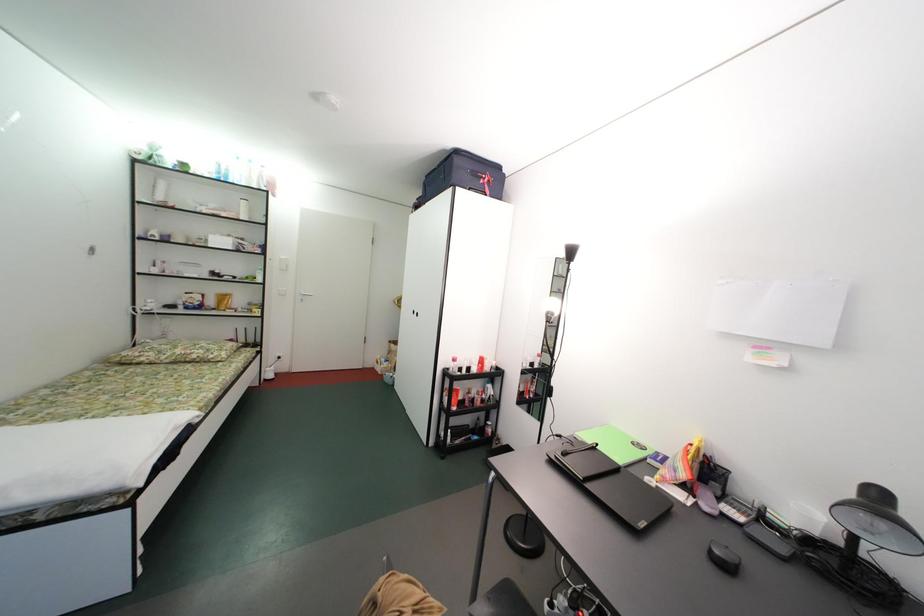
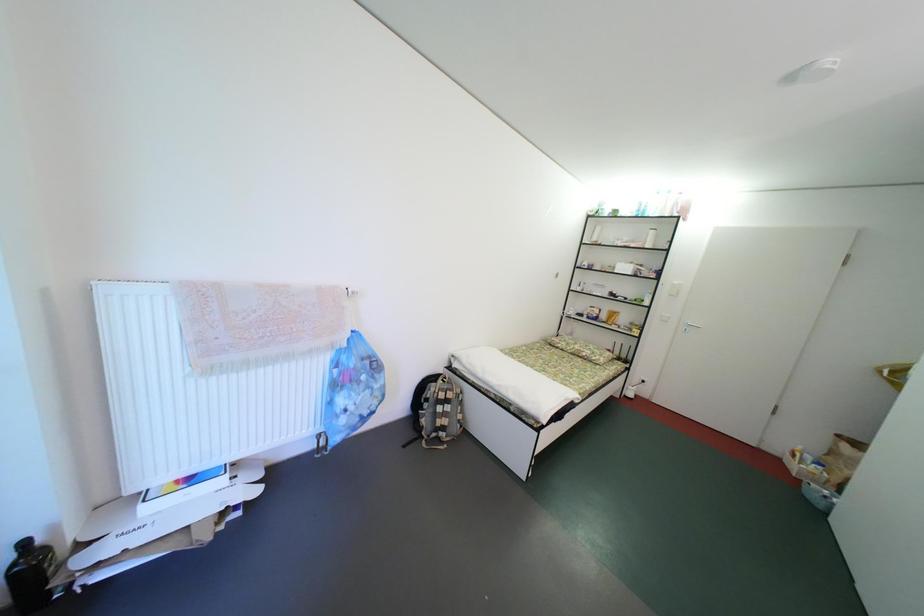
Question: The first image is from the beginning of the video and the second image is from the end. How did the camera likely rotate when shooting the video?

Choices:
 (A) Left
 (B) Right
 (C) Up
 (D) Down

Answer: (A)